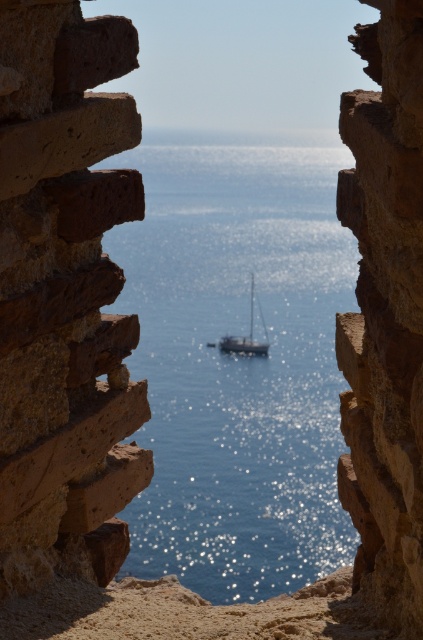
You are an artist standing in front of the stone window frame. You notice the blue glossy water at center and the brown rough stone at center. Which object is located to the right when viewed through the window?

The brown rough stone at center is located to the right of the blue glossy water at center.

You are standing in a coastal house and looking through a stone window frame. You see a brown rough stone at center and a white glossy sailboat at center. Which object is closer to you?

The brown rough stone at center is closer to the viewer than the white glossy sailboat at center.

You are standing in a coastal village and looking through a weathered stone window frame. You notice a point marked at coordinate (386, 314). What does this point correspond to in the scene?

The point at coordinate (386, 314) corresponds to the brown rough cliff at center.